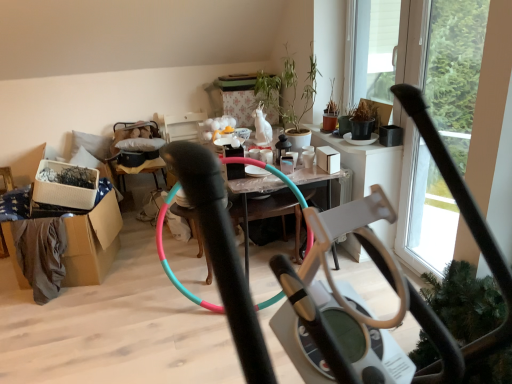
Measure the distance between matte black pot at upper right and camera.

matte black pot at upper right and camera are 9.12 feet apart from each other.

The height and width of the screenshot is (384, 512). Find the location of `matte black pot at upper right`. matte black pot at upper right is located at coordinates (342, 141).

Identify the location of white woven basket at left, the second box from the right. This screenshot has width=512, height=384. (65, 185).

Describe the element at coordinates (65, 185) in the screenshot. I see `white woven basket at left, the 1th box positioned from the left` at that location.

What do you see at coordinates (374, 52) in the screenshot?
I see `transparent glass window screen at upper right` at bounding box center [374, 52].

The height and width of the screenshot is (384, 512). In order to click on matte black pot at upper right in this screenshot , I will do `click(342, 141)`.

Which of these two, wooden cushioned armchair at center-left or matte black pot at upper right, is thinner?

With smaller width is matte black pot at upper right.

Based on their positions, is wooden cushioned armchair at center-left located to the left or right of matte black pot at upper right?

In the image, wooden cushioned armchair at center-left appears on the left side of matte black pot at upper right.

Does wooden cushioned armchair at center-left have a greater height compared to matte black pot at upper right?

Indeed, wooden cushioned armchair at center-left has a greater height compared to matte black pot at upper right.

Is wooden cushioned armchair at center-left located outside matte black pot at upper right?

wooden cushioned armchair at center-left is positioned outside matte black pot at upper right.

You are a GUI agent. You are given a task and a screenshot of the screen. Output one action in this format:
    pyautogui.click(x=<x>, y=<y>)
    Task: Click on the box on the left of translucent plastic table at center
    This screenshot has width=512, height=384.
    Given the screenshot: What is the action you would take?
    pyautogui.click(x=65, y=185)

Could you tell me if white woven basket at left, the second box from the right, is turned towards translucent plastic table at center?

No, white woven basket at left, the second box from the right, is not aimed at translucent plastic table at center.

From the image's perspective, which object appears higher, white woven basket at left, the second box from the right, or translucent plastic table at center?

From the image's view, white woven basket at left, the second box from the right, is above.

Which is behind, white woven basket at left, the 1th box positioned from the left, or translucent plastic table at center?

white woven basket at left, the 1th box positioned from the left, is further from the camera.

From the image's perspective, which one is positioned higher, brown cardboard box at left or green matte plant at upper center?

green matte plant at upper center.

I want to click on cardboard box that is under the green matte plant at upper center (from a real-world perspective), so click(92, 243).

Considering the sizes of objects brown cardboard box at left and green matte plant at upper center in the image provided, who is shorter, brown cardboard box at left or green matte plant at upper center?

brown cardboard box at left is shorter.

Is brown cardboard box at left to the right of green matte plant at upper center from the viewer's perspective?

No.

Which of these two, transparent glass window screen at upper right or wooden cushioned armchair at center-left, stands shorter?

Standing shorter between the two is wooden cushioned armchair at center-left.

Where is `window screen lying above the wooden cushioned armchair at center-left (from the image's perspective)`? The height and width of the screenshot is (384, 512). window screen lying above the wooden cushioned armchair at center-left (from the image's perspective) is located at coordinates tap(374, 52).

Is transparent glass window screen at upper right spatially inside wooden cushioned armchair at center-left, or outside of it?

transparent glass window screen at upper right cannot be found inside wooden cushioned armchair at center-left.

Is transparent glass window screen at upper right to the left of wooden cushioned armchair at center-left from the viewer's perspective?

In fact, transparent glass window screen at upper right is to the right of wooden cushioned armchair at center-left.

Is green matte plant at upper center oriented towards translucent plastic table at center?

No, green matte plant at upper center does not turn towards translucent plastic table at center.

Between green matte plant at upper center and translucent plastic table at center, which one appears on the right side from the viewer's perspective?

green matte plant at upper center is more to the right.

From a real-world perspective, does green matte plant at upper center stand above translucent plastic table at center?

Yes, from a real-world perspective, green matte plant at upper center is over translucent plastic table at center

From the picture: Measure the distance between green matte plant at upper center and translucent plastic table at center.

green matte plant at upper center and translucent plastic table at center are 2.09 meters apart from each other.

In terms of width, does brown cardboard box at left look wider or thinner when compared to wooden cushioned armchair at center-left?

Considering their sizes, brown cardboard box at left looks broader than wooden cushioned armchair at center-left.

Is brown cardboard box at left oriented towards wooden cushioned armchair at center-left?

No, brown cardboard box at left does not turn towards wooden cushioned armchair at center-left.

From a real-world perspective, between brown cardboard box at left and wooden cushioned armchair at center-left, who is vertically lower?

brown cardboard box at left.

Considering the positions of point (79, 279) and point (125, 165), is point (79, 279) closer or farther from the camera than point (125, 165)?

Point (79, 279) appears to be closer to the viewer than point (125, 165).

Which object is positioned more to the left, transparent glass window screen at upper right or matte black pot at upper right?

matte black pot at upper right.

Where is `window sill that is under the transparent glass window screen at upper right (from a real-world perspective)`? The width and height of the screenshot is (512, 384). window sill that is under the transparent glass window screen at upper right (from a real-world perspective) is located at coordinates (342, 141).

In the scene shown: From a real-world perspective, which is physically below, transparent glass window screen at upper right or matte black pot at upper right?

From a 3D spatial view, matte black pot at upper right is below.

Which point is more distant from viewer, (382, 93) or (394, 147)?

The point (382, 93) is farther from the camera.

At what (x,y) coordinates should I click in order to perform the action: click on armchair on the left of the matte black pot at upper right. Please return your answer as a coordinate pair (x, y). The image size is (512, 384). Looking at the image, I should click on (x=133, y=151).

From a real-world perspective, count 1st boxs upward from the translucent plastic table at center and point to it. Please provide its 2D coordinates.

[(65, 185)]

Based on their spatial positions, is transparent glass window screen at upper right or green matte plant at upper center closer to white woven basket at left, the 1th box positioned from the left?

Among the two, green matte plant at upper center is located nearer to white woven basket at left, the 1th box positioned from the left.

When comparing their distances from matte black pot at upper right, does white woven basket at left, the 1th box positioned from the left, or wooden cushioned armchair at center-left seem closer?

Based on the image, wooden cushioned armchair at center-left appears to be nearer to matte black pot at upper right.

When comparing their distances from green matte plant at upper center, does matte black pot at upper right or transparent glass window screen at upper right seem closer?

Based on the image, matte black pot at upper right appears to be nearer to green matte plant at upper center.

Considering their positions, is green matte plant at upper center positioned further to white matte box at center, the 2th box positioned from the left, than translucent plastic table at center?

translucent plastic table at center is positioned further to the anchor white matte box at center, the 2th box positioned from the left.

From the image, which object appears to be nearer to wooden cushioned armchair at center-left, brown cardboard box at left or green matte plant at upper center?

Among the two, brown cardboard box at left is located nearer to wooden cushioned armchair at center-left.

Looking at the image, which one is located closer to transparent glass window screen at upper right, wooden cushioned armchair at center-left or translucent plastic table at center?

wooden cushioned armchair at center-left lies closer to transparent glass window screen at upper right than the other object.

In the scene shown: Estimate the real-world distances between objects in this image. Which object is closer to brown cardboard box at left, transparent glass window screen at upper right or translucent plastic table at center?

The object closer to brown cardboard box at left is translucent plastic table at center.

Considering their positions, is transparent glass window screen at upper right positioned closer to white woven basket at left, the second box from the right, than wooden cushioned armchair at center-left?

wooden cushioned armchair at center-left lies closer to white woven basket at left, the second box from the right, than the other object.

The image size is (512, 384). Find the location of `table situated between white woven basket at left, the second box from the right, and white matte box at center, the 2th box positioned from the left, from left to right`. table situated between white woven basket at left, the second box from the right, and white matte box at center, the 2th box positioned from the left, from left to right is located at coordinates (206, 203).

You are a GUI agent. You are given a task and a screenshot of the screen. Output one action in this format:
    pyautogui.click(x=<x>, y=<y>)
    Task: Click on the houseplant between brown cardboard box at left and matte black pot at upper right in the horizontal direction
    The width and height of the screenshot is (512, 384).
    Given the screenshot: What is the action you would take?
    pyautogui.click(x=290, y=93)

Where is `armchair situated between brown cardboard box at left and matte black pot at upper right from left to right`? armchair situated between brown cardboard box at left and matte black pot at upper right from left to right is located at coordinates (133, 151).

Image resolution: width=512 pixels, height=384 pixels. What are the coordinates of `box between white woven basket at left, the second box from the right, and transparent glass window screen at upper right` in the screenshot? It's located at [328, 159].